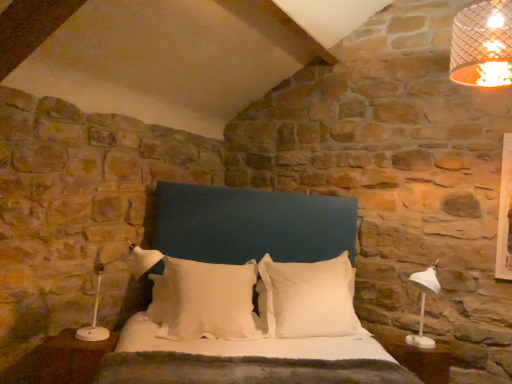
Describe the element at coordinates (414, 355) in the screenshot. The image size is (512, 384). I see `white plastic side table at lower right` at that location.

What do you see at coordinates (308, 298) in the screenshot? The width and height of the screenshot is (512, 384). I see `white soft pillow at center, marked as the 1th pillow in a right-to-left arrangement` at bounding box center [308, 298].

Where is `white soft pillow at center, which ranks as the first pillow in left-to-right order`? white soft pillow at center, which ranks as the first pillow in left-to-right order is located at coordinates (204, 300).

Considering the relative positions of brown wood nightstand at lower left and white plastic lamp at left in the image provided, is brown wood nightstand at lower left in front of white plastic lamp at left?

No, brown wood nightstand at lower left is further to the viewer.

How many degrees apart are the facing directions of brown wood nightstand at lower left and white plastic lamp at left?

52.4 degrees.

Identify the location of lamp that is in front of the brown wood nightstand at lower left. The width and height of the screenshot is (512, 384). (94, 315).

Does white soft pillow at center, positioned as the second pillow in right-to-left order, have a smaller size compared to white soft pillow at center, marked as the 1th pillow in a right-to-left arrangement?

Yes.

Considering the relative positions of white soft pillow at center, positioned as the second pillow in right-to-left order, and white soft pillow at center, the 2th pillow positioned from the left, in the image provided, is white soft pillow at center, positioned as the second pillow in right-to-left order, to the right of white soft pillow at center, the 2th pillow positioned from the left, from the viewer's perspective?

Incorrect, white soft pillow at center, positioned as the second pillow in right-to-left order, is not on the right side of white soft pillow at center, the 2th pillow positioned from the left.

How many degrees apart are the facing directions of white soft pillow at center, which ranks as the first pillow in left-to-right order, and white soft pillow at center, marked as the 1th pillow in a right-to-left arrangement?

They differ by 0.000685 degrees in their facing directions.

From the image's perspective, who appears lower, white soft pillow at center, positioned as the second pillow in right-to-left order, or white soft pillow at center, marked as the 1th pillow in a right-to-left arrangement?

From the image's view, white soft pillow at center, marked as the 1th pillow in a right-to-left arrangement, is below.

In the scene shown: How different are the orientations of white soft pillow at center, marked as the 1th pillow in a right-to-left arrangement, and brown wood nightstand at lower left in degrees?

There is a 4.91-degree angle between the facing directions of white soft pillow at center, marked as the 1th pillow in a right-to-left arrangement, and brown wood nightstand at lower left.

Is white soft pillow at center, the 2th pillow positioned from the left, further to the viewer compared to brown wood nightstand at lower left?

Yes, white soft pillow at center, the 2th pillow positioned from the left, is further from the viewer.

Between point (275, 297) and point (61, 332), which one is positioned behind?

Positioned behind is point (275, 297).

Is white soft pillow at center, marked as the 1th pillow in a right-to-left arrangement, aimed at brown wood nightstand at lower left?

No, white soft pillow at center, marked as the 1th pillow in a right-to-left arrangement, is not facing towards brown wood nightstand at lower left.

From the image's perspective, is white plastic lamp at left on top of white plastic side table at lower right?

Yes, from the image's perspective, white plastic lamp at left is on top of white plastic side table at lower right.

Would you say white plastic lamp at left is a long distance from white plastic side table at lower right?

That's right, there is a large distance between white plastic lamp at left and white plastic side table at lower right.

Which is more to the left, white plastic lamp at left or white plastic side table at lower right?

Positioned to the left is white plastic lamp at left.

From a real-world perspective, which object rests below the other?

white plastic side table at lower right is physically lower.

Is white soft pillow at center, the 2th pillow positioned from the left, smaller than white plastic lamp at left?

Result: No.

Can you tell me how much white soft pillow at center, the 2th pillow positioned from the left, and white plastic lamp at left differ in facing direction?

There is a 47.5-degree angle between the facing directions of white soft pillow at center, the 2th pillow positioned from the left, and white plastic lamp at left.

In the image, is white soft pillow at center, marked as the 1th pillow in a right-to-left arrangement, positioned in front of or behind white plastic lamp at left?

Visually, white soft pillow at center, marked as the 1th pillow in a right-to-left arrangement, is located behind white plastic lamp at left.

Is point (289, 320) closer or farther from the camera than point (83, 332)?

Point (289, 320) is farther from the camera than point (83, 332).

Is white soft pillow at center, marked as the 1th pillow in a right-to-left arrangement, positioned before white plastic side table at lower right?

No, white soft pillow at center, marked as the 1th pillow in a right-to-left arrangement, is further to the viewer.

From the image's perspective, relative to white plastic side table at lower right, is white soft pillow at center, marked as the 1th pillow in a right-to-left arrangement, above or below?

white soft pillow at center, marked as the 1th pillow in a right-to-left arrangement, is above white plastic side table at lower right.

Where is `side table below the white soft pillow at center, marked as the 1th pillow in a right-to-left arrangement (from the image's perspective)`? Image resolution: width=512 pixels, height=384 pixels. side table below the white soft pillow at center, marked as the 1th pillow in a right-to-left arrangement (from the image's perspective) is located at coordinates (414, 355).

Considering the sizes of white soft pillow at center, marked as the 1th pillow in a right-to-left arrangement, and white plastic side table at lower right in the image, is white soft pillow at center, marked as the 1th pillow in a right-to-left arrangement, taller or shorter than white plastic side table at lower right?

Clearly, white soft pillow at center, marked as the 1th pillow in a right-to-left arrangement, is taller compared to white plastic side table at lower right.

Between white plastic side table at lower right and white plastic lamp at left, which one has smaller size?

white plastic side table at lower right is smaller.

Does white plastic side table at lower right turn towards white plastic lamp at left?

No.

Is point (394, 357) farther from camera compared to point (129, 243)?

No, it is in front of (129, 243).

Can you confirm if white plastic side table at lower right is thinner than white plastic lamp at left?

Indeed, white plastic side table at lower right has a lesser width compared to white plastic lamp at left.

Find the location of a particular element. The height and width of the screenshot is (384, 512). lamp that is on the right side of brown wood nightstand at lower left is located at coordinates (94, 315).

You are a GUI agent. You are given a task and a screenshot of the screen. Output one action in this format:
    pyautogui.click(x=<x>, y=<y>)
    Task: Click on the pillow in front of the white soft pillow at center, the 2th pillow positioned from the left
    The image size is (512, 384).
    Given the screenshot: What is the action you would take?
    pyautogui.click(x=204, y=300)

Based on their spatial positions, is white soft pillow at center, marked as the 1th pillow in a right-to-left arrangement, or white plastic lamp at left closer to white soft pillow at center, which ranks as the first pillow in left-to-right order?

white soft pillow at center, marked as the 1th pillow in a right-to-left arrangement, lies closer to white soft pillow at center, which ranks as the first pillow in left-to-right order, than the other object.

Looking at the image, which one is located closer to brown wood nightstand at lower left, white plastic side table at lower right or white plastic lamp at left?

white plastic lamp at left lies closer to brown wood nightstand at lower left than the other object.

Estimate the real-world distances between objects in this image. Which object is closer to white soft pillow at center, which ranks as the first pillow in left-to-right order, brown wood nightstand at lower left or white plastic lamp at left?

brown wood nightstand at lower left is closer to white soft pillow at center, which ranks as the first pillow in left-to-right order.

Considering their positions, is white plastic side table at lower right positioned further to white soft pillow at center, the 2th pillow positioned from the left, than brown wood nightstand at lower left?

brown wood nightstand at lower left lies further to white soft pillow at center, the 2th pillow positioned from the left, than the other object.

Estimate the real-world distances between objects in this image. Which object is closer to white plastic lamp at left, white plastic side table at lower right or white soft pillow at center, marked as the 1th pillow in a right-to-left arrangement?

white soft pillow at center, marked as the 1th pillow in a right-to-left arrangement, is closer to white plastic lamp at left.

From the image, which object appears to be farther from white plastic side table at lower right, white soft pillow at center, the 2th pillow positioned from the left, or white plastic lamp at left?

Based on the image, white plastic lamp at left appears to be further to white plastic side table at lower right.

Based on the photo, looking at the image, which one is located further to brown wood nightstand at lower left, white plastic lamp at left or white soft pillow at center, marked as the 1th pillow in a right-to-left arrangement?

white soft pillow at center, marked as the 1th pillow in a right-to-left arrangement, lies further to brown wood nightstand at lower left than the other object.

Looking at the image, which one is located further to brown wood nightstand at lower left, white plastic side table at lower right or white soft pillow at center, marked as the 1th pillow in a right-to-left arrangement?

white plastic side table at lower right is further to brown wood nightstand at lower left.

Locate an element on the screen. This screenshot has height=384, width=512. lamp between brown wood nightstand at lower left and white soft pillow at center, the 2th pillow positioned from the left, from left to right is located at coordinates (94, 315).

In order to click on lamp between brown wood nightstand at lower left and white plastic side table at lower right from left to right in this screenshot , I will do `click(94, 315)`.

You are a GUI agent. You are given a task and a screenshot of the screen. Output one action in this format:
    pyautogui.click(x=<x>, y=<y>)
    Task: Click on the pillow situated between brown wood nightstand at lower left and white soft pillow at center, marked as the 1th pillow in a right-to-left arrangement, from left to right
    Image resolution: width=512 pixels, height=384 pixels.
    Given the screenshot: What is the action you would take?
    pyautogui.click(x=204, y=300)

This screenshot has width=512, height=384. I want to click on lamp situated between brown wood nightstand at lower left and white soft pillow at center, which ranks as the first pillow in left-to-right order, from left to right, so click(x=94, y=315).